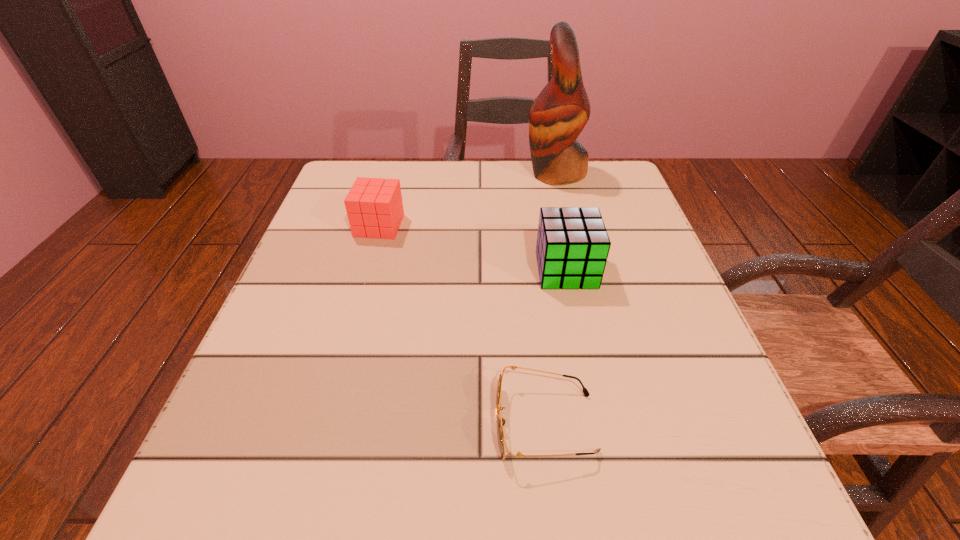
Find the location of a particular element. The image size is (960, 540). parrot at the right edge is located at coordinates (558, 115).

Where is `cube that is positioned at the right edge`? cube that is positioned at the right edge is located at coordinates (572, 247).

Locate an element on the screen. The height and width of the screenshot is (540, 960). object at the far left corner is located at coordinates (374, 207).

This screenshot has width=960, height=540. Find the location of `object present at the far right corner`. object present at the far right corner is located at coordinates (558, 115).

This screenshot has height=540, width=960. Find the location of `free spot at the far edge of the desktop`. free spot at the far edge of the desktop is located at coordinates (456, 200).

The width and height of the screenshot is (960, 540). In the image, there is a desktop. Identify the location of free space at the near edge. (515, 477).

You are a GUI agent. You are given a task and a screenshot of the screen. Output one action in this format:
    pyautogui.click(x=<x>, y=<y>)
    Task: Click on the vacant space at the left edge
    
    Given the screenshot: What is the action you would take?
    pyautogui.click(x=363, y=249)

I want to click on vacant space at the right edge of the desktop, so click(652, 317).

Image resolution: width=960 pixels, height=540 pixels. Identify the location of vacant region at the far left corner. (361, 165).

In the image, there is a desktop. In order to click on vacant region at the near left corner in this screenshot , I will do `click(254, 532)`.